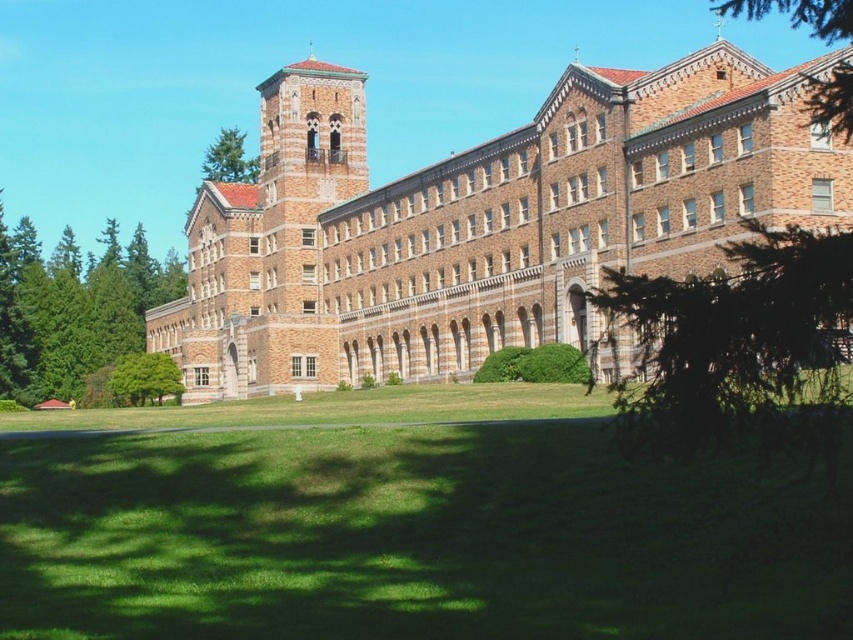
Question: Does green leafy tree at center have a larger size compared to green leafy tree at upper right?

Choices:
 (A) yes
 (B) no

Answer: (B)

Question: Which of these objects is positioned closest to the green leafy tree at center?

Choices:
 (A) green leafy tree at upper right
 (B) green grass at lower center
 (C) green leafy tree at left
 (D) green leafy tree at upper center

Answer: (B)

Question: Which object is the farthest from the green leafy tree at left?

Choices:
 (A) green leafy tree at center
 (B) green leafy tree at upper right
 (C) green grass at lower center
 (D) green leafy tree at lower left

Answer: (A)

Question: Can you confirm if green grass at lower center is bigger than green leafy tree at upper right?

Choices:
 (A) yes
 (B) no

Answer: (B)

Question: Observing the image, what is the correct spatial positioning of green leafy tree at upper right in reference to green leafy tree at lower left?

Choices:
 (A) left
 (B) right

Answer: (B)

Question: Which object is closer to the camera taking this photo?

Choices:
 (A) green leafy tree at upper right
 (B) green leafy tree at center

Answer: (B)